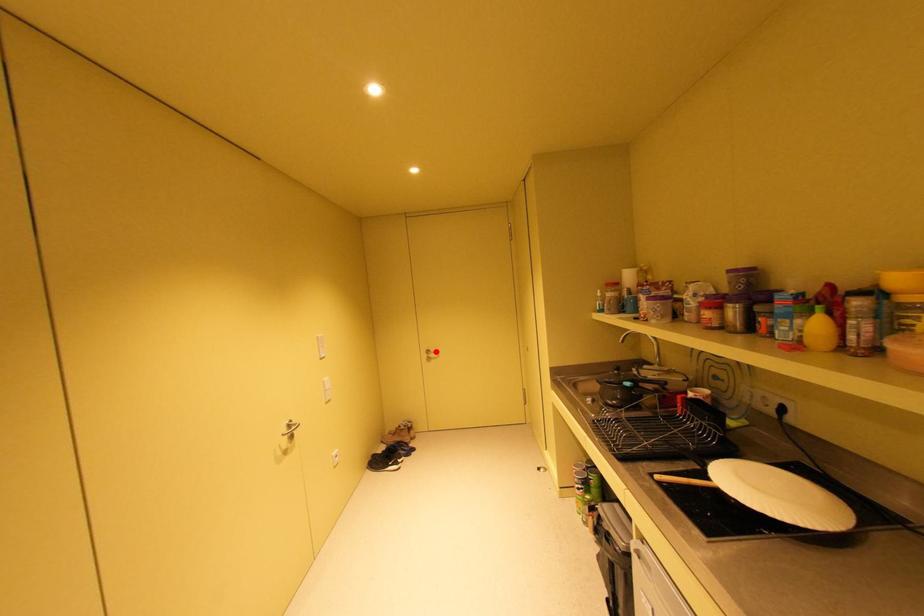
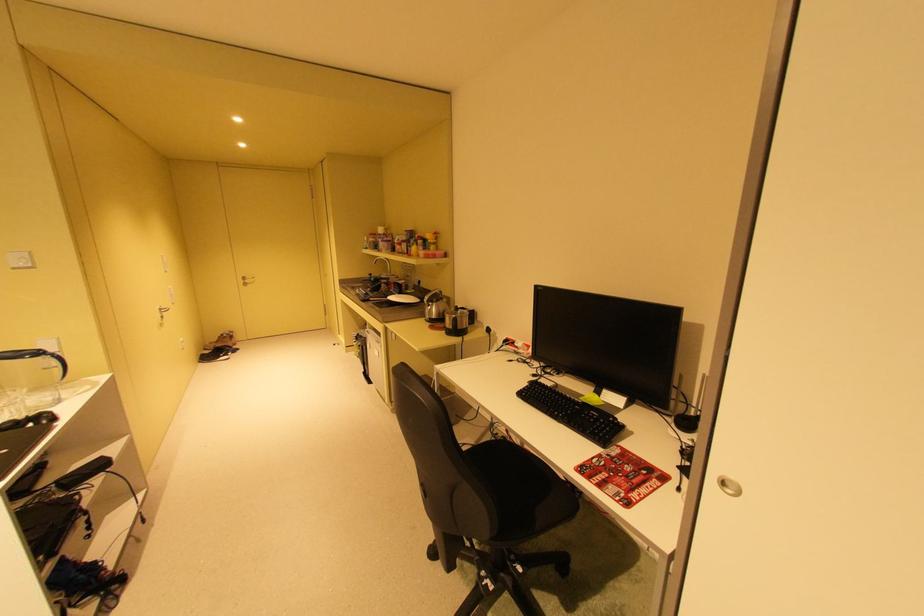
Locate, in the second image, the point that corresponds to the highlighted location in the first image.

(252, 278)